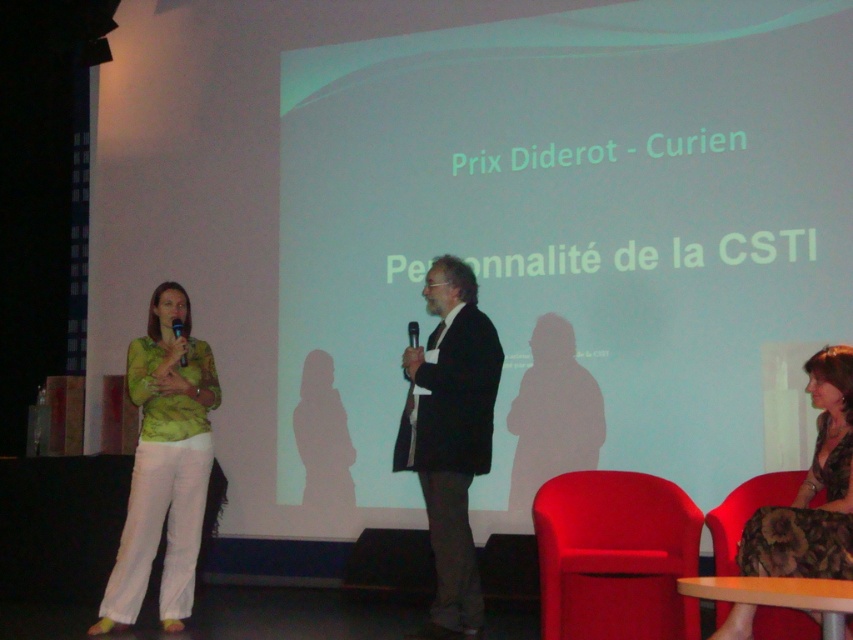
Which is in front, point (165, 611) or point (467, 273)?

Point (467, 273) is more forward.

Between green matte shirt at left and dark brown suit at center, which one has less height?

green matte shirt at left

Describe the element at coordinates (164, 467) in the screenshot. The image size is (853, 640). I see `green matte shirt at left` at that location.

This screenshot has width=853, height=640. What are the coordinates of `green matte shirt at left` in the screenshot? It's located at (164, 467).

Between point (431, 614) and point (833, 419), which one is positioned behind?

The point (431, 614) is more distant.

Between dark brown suit at center and velvet brown dress at lower right, which one has more height?

dark brown suit at center is taller.

Does point (432, 403) come behind point (776, 525)?

That is True.

The width and height of the screenshot is (853, 640). Find the location of `dark brown suit at center`. dark brown suit at center is located at coordinates (450, 436).

Between point (798, 554) and point (172, 326), which one is positioned behind?

The point (172, 326) is more distant.

Is velvet brown dress at lower right taller than matte black microphone at left?

Indeed, velvet brown dress at lower right has a greater height compared to matte black microphone at left.

Does point (807, 529) come behind point (173, 324)?

That is False.

The height and width of the screenshot is (640, 853). Find the location of `velvet brown dress at lower right`. velvet brown dress at lower right is located at coordinates (811, 490).